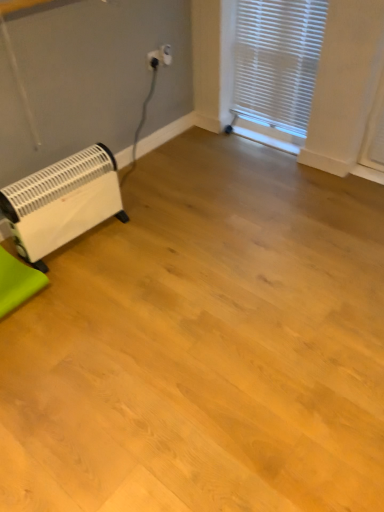
Question: From a real-world perspective, is white plastic electric outlet at upper center physically located above or below green fabric at lower left?

Choices:
 (A) below
 (B) above

Answer: (B)

Question: Based on their sizes in the image, would you say white plastic electric outlet at upper center is bigger or smaller than green fabric at lower left?

Choices:
 (A) big
 (B) small

Answer: (B)

Question: Which object is the closest to the green fabric at lower left?

Choices:
 (A) white plastic heater at lower left
 (B) white plastic blinds at upper right
 (C) white plastic electric outlet at upper center

Answer: (A)

Question: Estimate the real-world distances between objects in this image. Which object is closer to the white plastic blinds at upper right?

Choices:
 (A) white plastic heater at lower left
 (B) white plastic electric outlet at upper center
 (C) green fabric at lower left

Answer: (B)